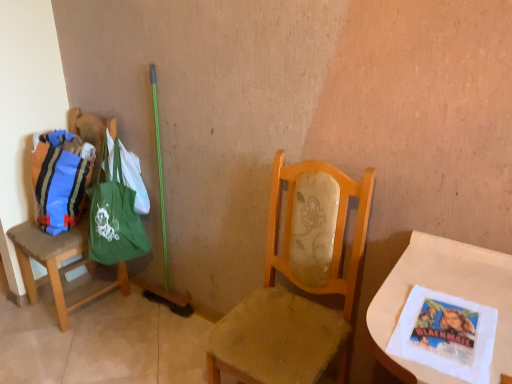
This screenshot has height=384, width=512. Describe the element at coordinates (115, 214) in the screenshot. I see `green canvas tote at left` at that location.

What do you see at coordinates (298, 283) in the screenshot? This screenshot has height=384, width=512. I see `wooden chair at center, which is counted as the 1th chair, starting from the front` at bounding box center [298, 283].

Image resolution: width=512 pixels, height=384 pixels. Describe the element at coordinates (60, 179) in the screenshot. I see `matte blue fabric bag at left` at that location.

The height and width of the screenshot is (384, 512). In order to click on green canvas tote at left in this screenshot , I will do `click(115, 214)`.

From a real-world perspective, who is located lower, green canvas tote at left or wooden chair at center, which ranks as the 2th chair in back-to-front order?

wooden chair at center, which ranks as the 2th chair in back-to-front order, from a real-world perspective.

Who is smaller, green canvas tote at left or wooden chair at center, which is counted as the 1th chair, starting from the front?

Smaller between the two is green canvas tote at left.

Does green canvas tote at left turn towards wooden chair at center, which ranks as the 2th chair in back-to-front order?

No, green canvas tote at left does not turn towards wooden chair at center, which ranks as the 2th chair in back-to-front order.

From a real-world perspective, is matte blue fabric bag at left on green fabric bag at left, which is the 1th chair in left-to-right order?

Yes, from a real-world perspective, matte blue fabric bag at left is over green fabric bag at left, which is the 1th chair in left-to-right order

Which is in front, matte blue fabric bag at left or green fabric bag at left, marked as the 1th chair in a back-to-front arrangement?

Positioned in front is green fabric bag at left, marked as the 1th chair in a back-to-front arrangement.

Find the location of a particular element. grocery bag on the right of green fabric bag at left, the second chair when ordered from right to left is located at coordinates (60, 179).

Consider the image. Is matte blue fabric bag at left positioned beyond the bounds of green fabric bag at left, the second chair when ordered from right to left?

Actually, matte blue fabric bag at left is within green fabric bag at left, the second chair when ordered from right to left.

Could matte blue fabric bag at left be considered to be inside white paper napkin at lower right?

Definitely not — matte blue fabric bag at left is not inside white paper napkin at lower right.

What's the angular difference between white paper napkin at lower right and matte blue fabric bag at left's facing directions?

They differ by 5.86 degrees in their facing directions.

Is white paper napkin at lower right oriented away from matte blue fabric bag at left?

No, white paper napkin at lower right is not facing away from matte blue fabric bag at left.

Is wooden chair at center, which is counted as the 1th chair, starting from the front, beside green canvas tote at left?

No, wooden chair at center, which is counted as the 1th chair, starting from the front, is not touching green canvas tote at left.

Considering the sizes of objects wooden chair at center, arranged as the first chair when viewed from the right, and green canvas tote at left in the image provided, who is thinner, wooden chair at center, arranged as the first chair when viewed from the right, or green canvas tote at left?

With smaller width is green canvas tote at left.

Which object is positioned more to the left, wooden chair at center, which ranks as the 2th chair in back-to-front order, or green canvas tote at left?

green canvas tote at left.

From a real-world perspective, is wooden chair at center, arranged as the first chair when viewed from the right, positioned over green canvas tote at left based on gravity?

No, from a real-world perspective, wooden chair at center, arranged as the first chair when viewed from the right, is not over green canvas tote at left

Is point (130, 200) more distant than point (100, 147)?

No, (130, 200) is in front of (100, 147).

Can you confirm if green canvas tote at left is taller than green fabric bag at left, the 2th chair when ordered from front to back?

No.

Who is smaller, green canvas tote at left or green fabric bag at left, marked as the 1th chair in a back-to-front arrangement?

Smaller between the two is green canvas tote at left.

Considering the relative sizes of green canvas tote at left and green fabric bag at left, the 2th chair when ordered from front to back, in the image provided, is green canvas tote at left wider than green fabric bag at left, the 2th chair when ordered from front to back,?

In fact, green canvas tote at left might be narrower than green fabric bag at left, the 2th chair when ordered from front to back.

From a real-world perspective, which is physically above, green fabric bag at left, the 2th chair when ordered from front to back, or matte blue fabric bag at left?

matte blue fabric bag at left.

Does point (114, 121) appear closer or farther from the camera than point (83, 183)?

Point (114, 121) is farther from the camera than point (83, 183).

Measure the distance from green fabric bag at left, the second chair when ordered from right to left, to matte blue fabric bag at left.

green fabric bag at left, the second chair when ordered from right to left, is 9.04 inches from matte blue fabric bag at left.

Is green fabric bag at left, the 2th chair when ordered from front to back, in front of matte blue fabric bag at left?

Yes, green fabric bag at left, the 2th chair when ordered from front to back, is closer to the viewer.

Is wooden chair at center, which is counted as the 1th chair, starting from the front, surrounding white paper napkin at lower right?

That's incorrect, white paper napkin at lower right is not inside wooden chair at center, which is counted as the 1th chair, starting from the front.

Looking at this image, is wooden chair at center, the second chair from the left, positioned with its back to white paper napkin at lower right?

No, white paper napkin at lower right is not at the back of wooden chair at center, the second chair from the left.

Considering the positions of point (347, 201) and point (383, 299), is point (347, 201) closer or farther from the camera than point (383, 299)?

Point (347, 201) is farther from the camera than point (383, 299).

Can you confirm if wooden chair at center, which ranks as the 2th chair in back-to-front order, is thinner than white paper napkin at lower right?

No, wooden chair at center, which ranks as the 2th chair in back-to-front order, is not thinner than white paper napkin at lower right.

What are the coordinates of `shoulder bag above the wooden chair at center, arranged as the first chair when viewed from the right (from a real-world perspective)` in the screenshot? It's located at click(x=115, y=214).

From a real-world perspective, which chair is the 2nd one underneath the matte blue fabric bag at left? Please provide its 2D coordinates.

[(58, 263)]

Which object lies further to the anchor point green canvas tote at left, green fabric bag at left, the 2th chair when ordered from front to back, or matte blue fabric bag at left?

Based on the image, green fabric bag at left, the 2th chair when ordered from front to back, appears to be further to green canvas tote at left.

When comparing their distances from green fabric bag at left, the 2th chair when ordered from front to back, does green canvas tote at left or wooden chair at center, arranged as the first chair when viewed from the right, seem further?

wooden chair at center, arranged as the first chair when viewed from the right, is positioned further to the anchor green fabric bag at left, the 2th chair when ordered from front to back.

When comparing their distances from wooden chair at center, the second chair from the left, does matte blue fabric bag at left or green fabric bag at left, the second chair when ordered from right to left, seem further?

The object further to wooden chair at center, the second chair from the left, is matte blue fabric bag at left.

Based on their spatial positions, is wooden chair at center, which ranks as the 2th chair in back-to-front order, or white paper napkin at lower right further from green canvas tote at left?

white paper napkin at lower right lies further to green canvas tote at left than the other object.

Which object lies further to the anchor point green canvas tote at left, white paper napkin at lower right or matte blue fabric bag at left?

Among the two, white paper napkin at lower right is located further to green canvas tote at left.

From the image, which object appears to be farther from white paper napkin at lower right, matte blue fabric bag at left or green fabric bag at left, which is the 1th chair in left-to-right order?

green fabric bag at left, which is the 1th chair in left-to-right order, lies further to white paper napkin at lower right than the other object.

Considering their positions, is green canvas tote at left positioned further to white paper napkin at lower right than matte blue fabric bag at left?

Based on the image, matte blue fabric bag at left appears to be further to white paper napkin at lower right.

Estimate the real-world distances between objects in this image. Which object is further from white paper napkin at lower right, wooden chair at center, which is counted as the 1th chair, starting from the front, or green fabric bag at left, which is the 1th chair in left-to-right order?

green fabric bag at left, which is the 1th chair in left-to-right order, is positioned further to the anchor white paper napkin at lower right.

This screenshot has width=512, height=384. What are the coordinates of `grocery bag between green fabric bag at left, the second chair when ordered from right to left, and green canvas tote at left from left to right` in the screenshot? It's located at 60,179.

Find the location of `shoulder bag between matte blue fabric bag at left and wooden chair at center, which ranks as the 2th chair in back-to-front order`. shoulder bag between matte blue fabric bag at left and wooden chair at center, which ranks as the 2th chair in back-to-front order is located at coordinates (115, 214).

The height and width of the screenshot is (384, 512). Identify the location of chair located between matte blue fabric bag at left and white paper napkin at lower right in the left-right direction. (298, 283).

The height and width of the screenshot is (384, 512). Find the location of `chair situated between green fabric bag at left, the 2th chair when ordered from front to back, and white paper napkin at lower right from left to right`. chair situated between green fabric bag at left, the 2th chair when ordered from front to back, and white paper napkin at lower right from left to right is located at coordinates (298, 283).